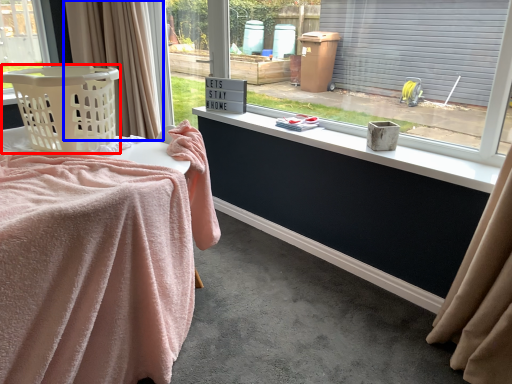
Question: Which object is further to the camera taking this photo, basket (highlighted by a red box) or curtain (highlighted by a blue box)?

Choices:
 (A) basket
 (B) curtain

Answer: (B)